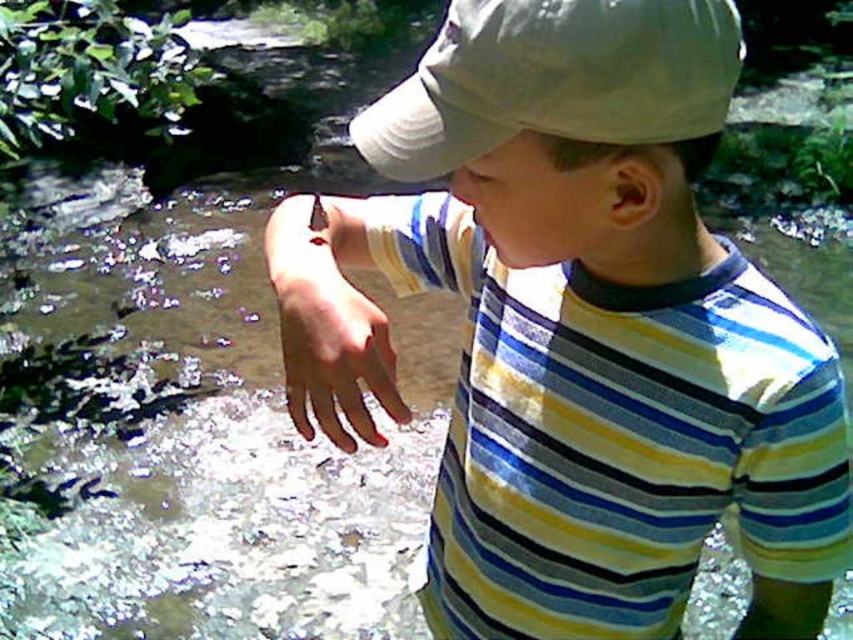
In the scene shown: Is white fabric cap at upper center below pale skin hand at center?

Actually, white fabric cap at upper center is above pale skin hand at center.

Is white fabric cap at upper center bigger than pale skin hand at center?

Actually, white fabric cap at upper center might be smaller than pale skin hand at center.

Locate an element on the screen. The image size is (853, 640). white fabric cap at upper center is located at coordinates (555, 80).

Is matte striped shirt at center to the left of white fabric cap at upper center from the viewer's perspective?

In fact, matte striped shirt at center is to the right of white fabric cap at upper center.

The width and height of the screenshot is (853, 640). I want to click on matte striped shirt at center, so click(576, 328).

Does point (633, 531) lie in front of point (309, 344)?

No, it is not.

Is point (439, 134) farther from viewer compared to point (277, 280)?

No, (439, 134) is in front of (277, 280).

Image resolution: width=853 pixels, height=640 pixels. Find the location of `matte striped shirt at center`. matte striped shirt at center is located at coordinates (576, 328).

Where is `matte striped shirt at center`? matte striped shirt at center is located at coordinates coord(576,328).